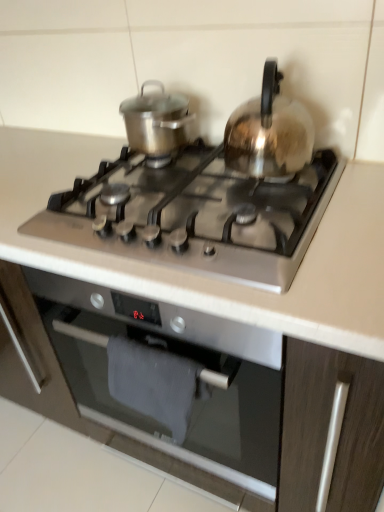
At what (x,y) coordinates should I click in order to perform the action: click on free space in front of shiny metallic pot at upper left, the 2th kitchen appliance from the right. Please return your answer as a coordinate pair (x, y). Looking at the image, I should click on (130, 170).